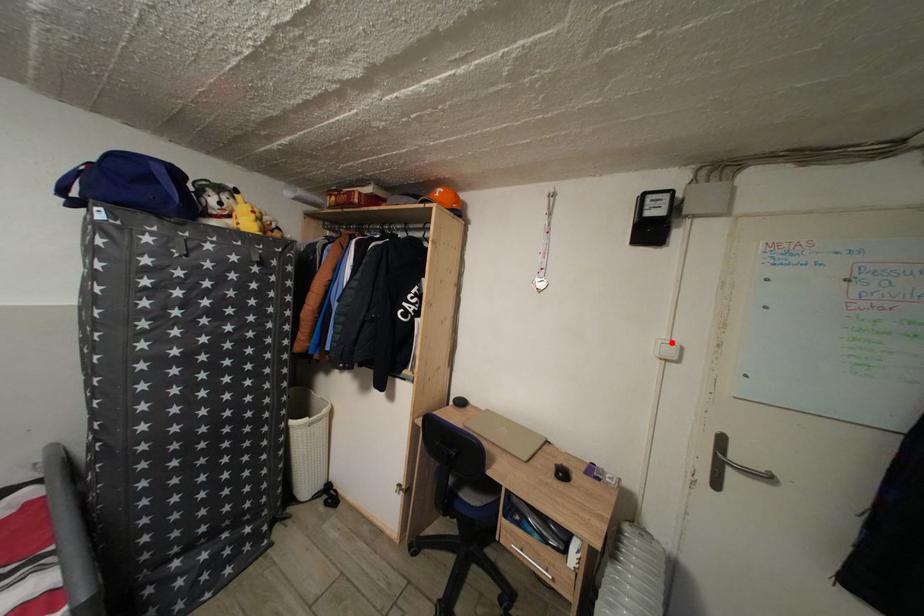
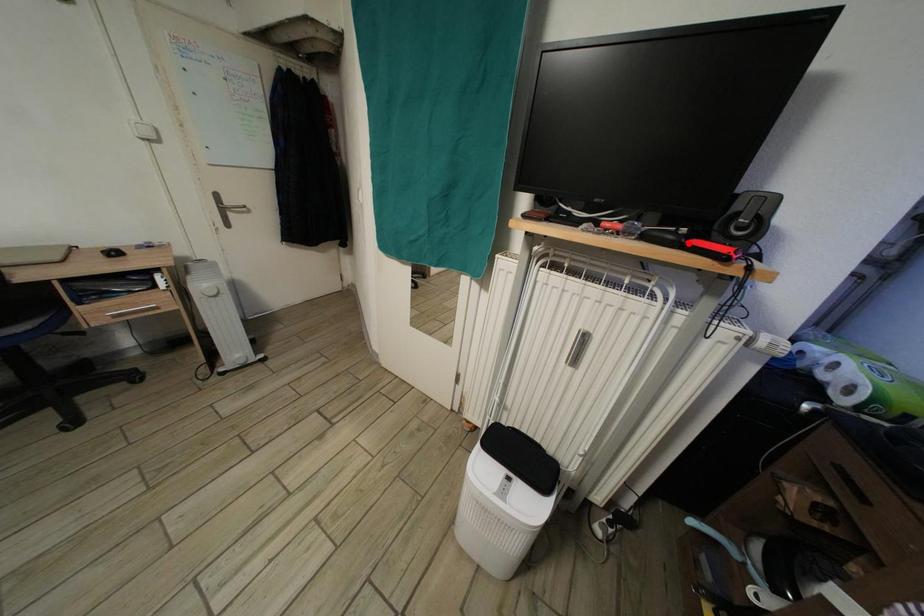
I am providing you with two images of the same scene from different viewpoints. A red point is marked on the first image and another point is marked on the second image. Does the point marked in image1 correspond to the same location as the one in image2?

No